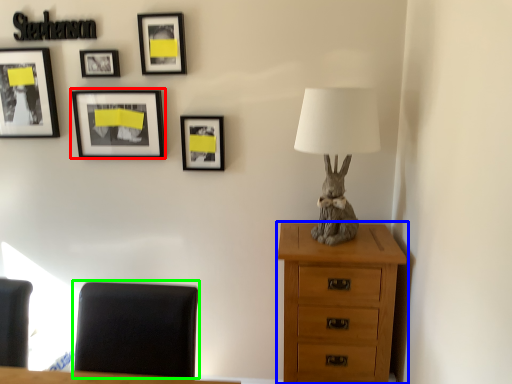
Question: Which object is the closest to the picture frame (highlighted by a red box)? Choose among these: chest of drawers (highlighted by a blue box) or furniture (highlighted by a green box).

Choices:
 (A) chest of drawers
 (B) furniture

Answer: (B)